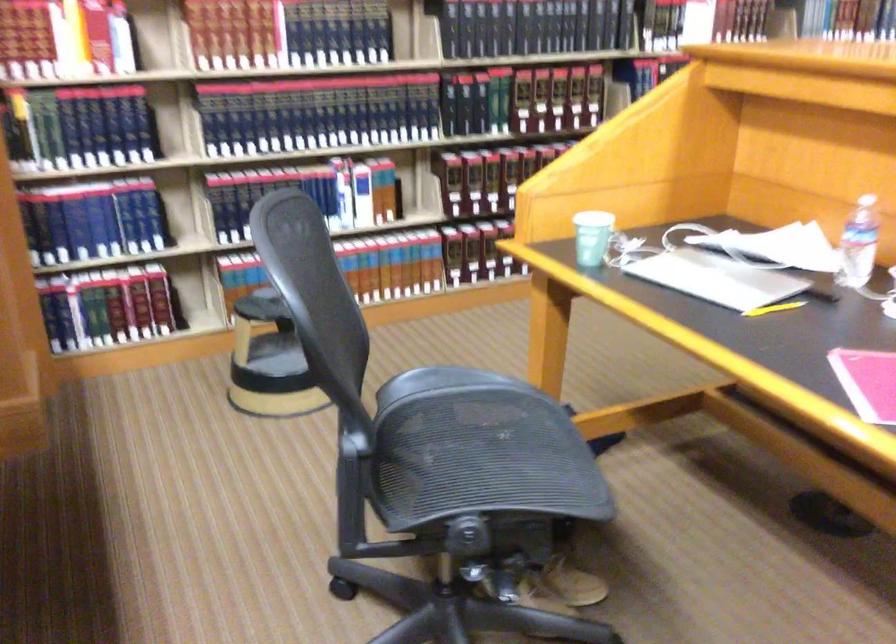
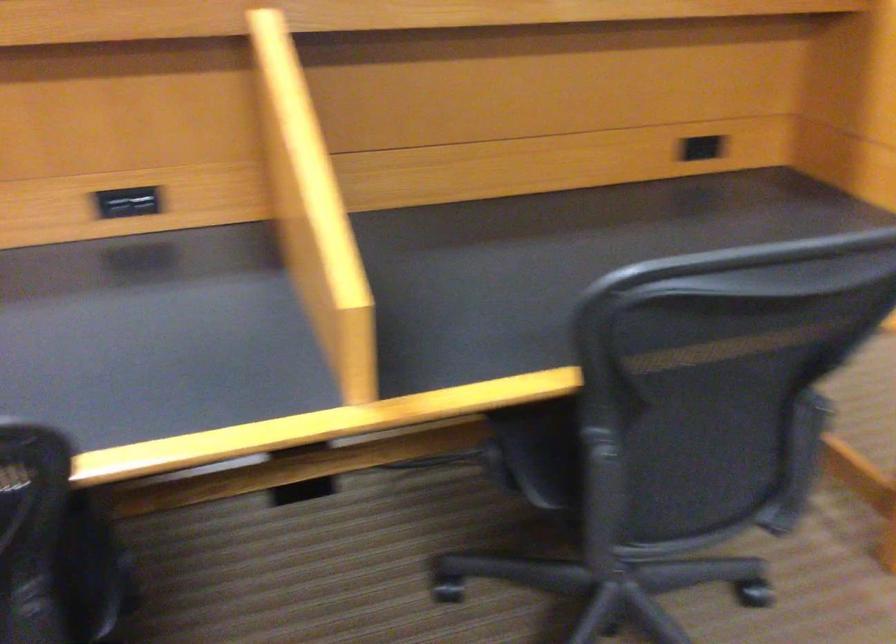
Question: I am providing you with two images of the same scene from different viewpoints. After the viewpoint changes to image2, which objects are now occluded?

Choices:
 (A) grey paper tray knob
 (B) chair sitting surface
 (C) black power outlet
 (D) chair armrest

Answer: (B)